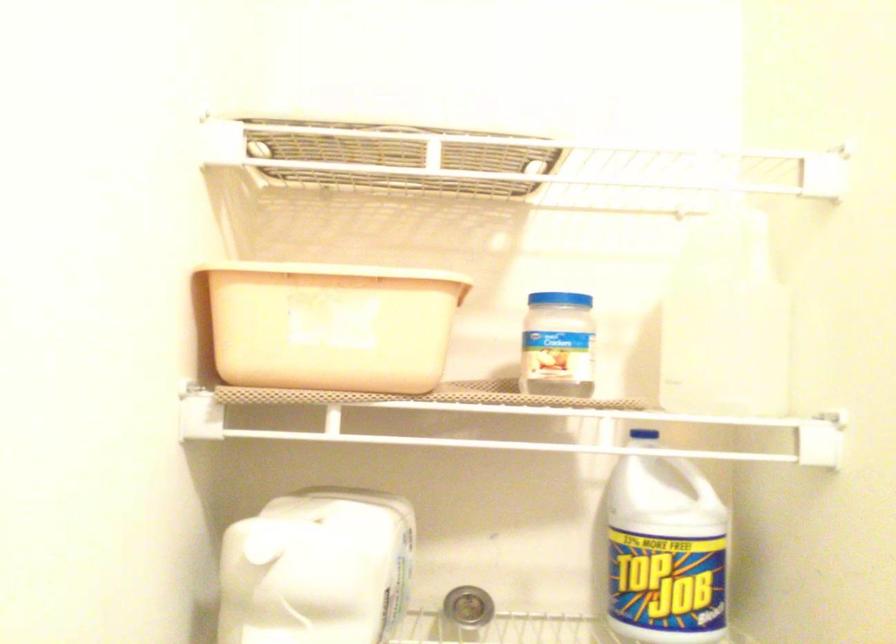
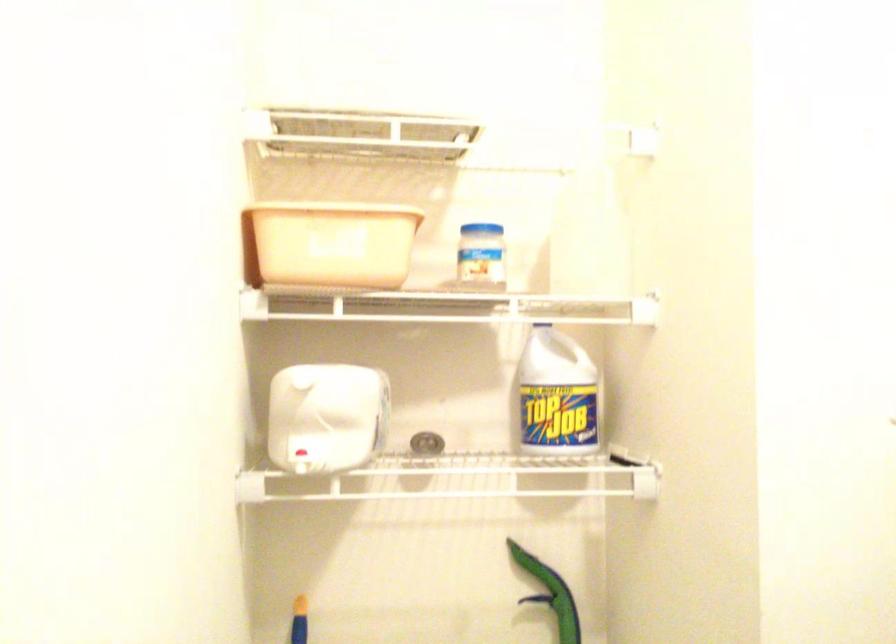
The point at (664,552) is marked in the first image. Where is the corresponding point in the second image?

(556, 395)